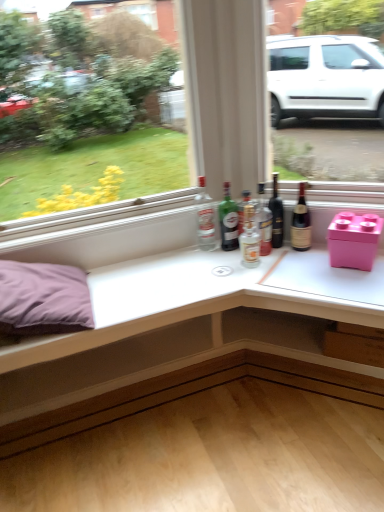
You are a GUI agent. You are given a task and a screenshot of the screen. Output one action in this format:
    pyautogui.click(x=<x>, y=<y>)
    Task: Click on the blank area to the left of translucent glass bottle at center, acting as the 2th bottle starting from the right
    
    Given the screenshot: What is the action you would take?
    pyautogui.click(x=218, y=262)